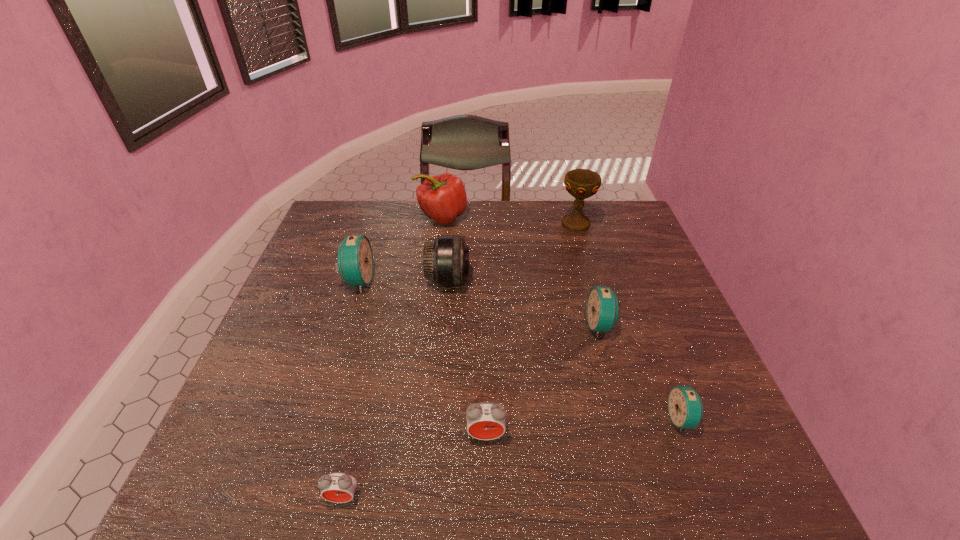
Choose which blue alarm clock is the second nearest neighbor to the farthest blue alarm clock. Please provide its 2D coordinates. Your answer should be formatted as a tuple, i.e. [(x, y)], where the tuple contains the x and y coordinates of a point satisfying the conditions above.

[(685, 407)]

Locate an element on the screen. free point that satisfies the following two spatial constraints: 1. on the front side of the red chalice; 2. on the right side of the bell pepper is located at coordinates (441, 224).

Find the location of `vacant space that satisfies the following two spatial constraints: 1. on the front-facing side of the second farthest alarm clock; 2. on the face of the farther red alarm clock`. vacant space that satisfies the following two spatial constraints: 1. on the front-facing side of the second farthest alarm clock; 2. on the face of the farther red alarm clock is located at coordinates (631, 435).

This screenshot has height=540, width=960. Identify the location of vacant position in the image that satisfies the following two spatial constraints: 1. on the front-facing side of the rightmost blue alarm clock; 2. on the face of the left red alarm clock. (711, 497).